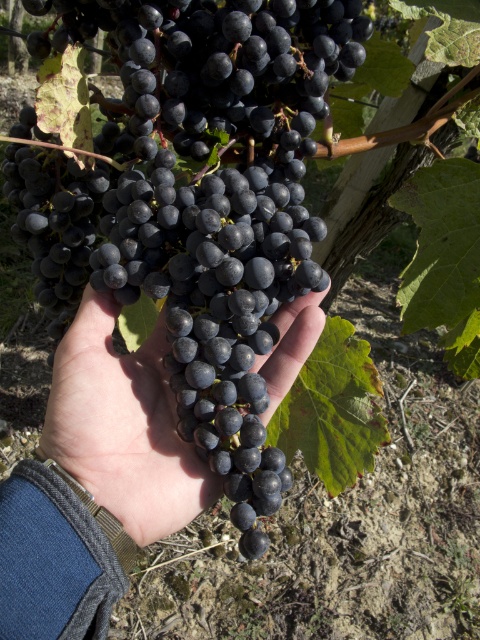
Does shiny dark purple grapes at center appear on the right side of matte black grapes at center?

Correct, you'll find shiny dark purple grapes at center to the right of matte black grapes at center.

Does shiny dark purple grapes at center have a lesser height compared to matte black grapes at center?

No.

Between point (214, 369) and point (60, 378), which one is positioned in front?

Point (214, 369) is more forward.

Identify the location of shiny dark purple grapes at center. Image resolution: width=480 pixels, height=640 pixels. (193, 195).